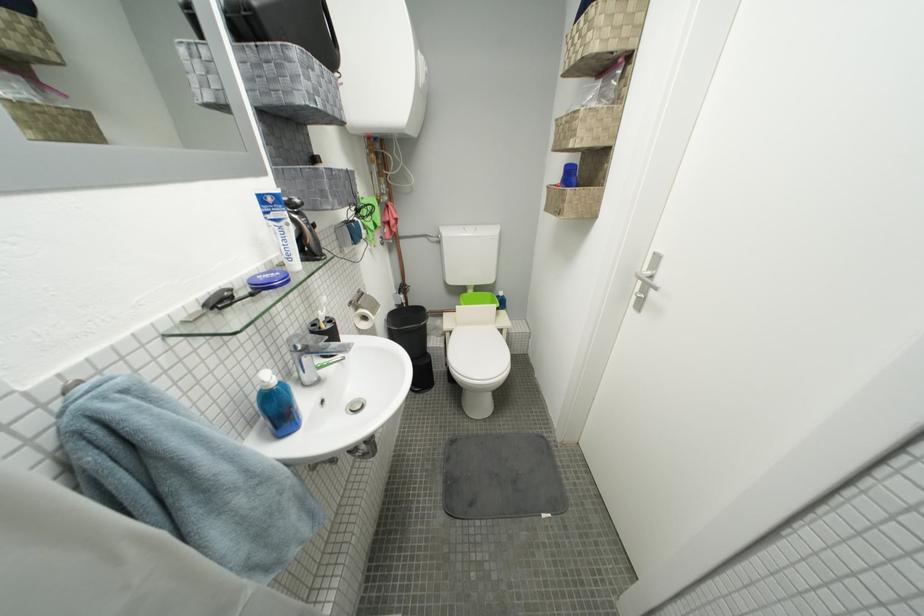
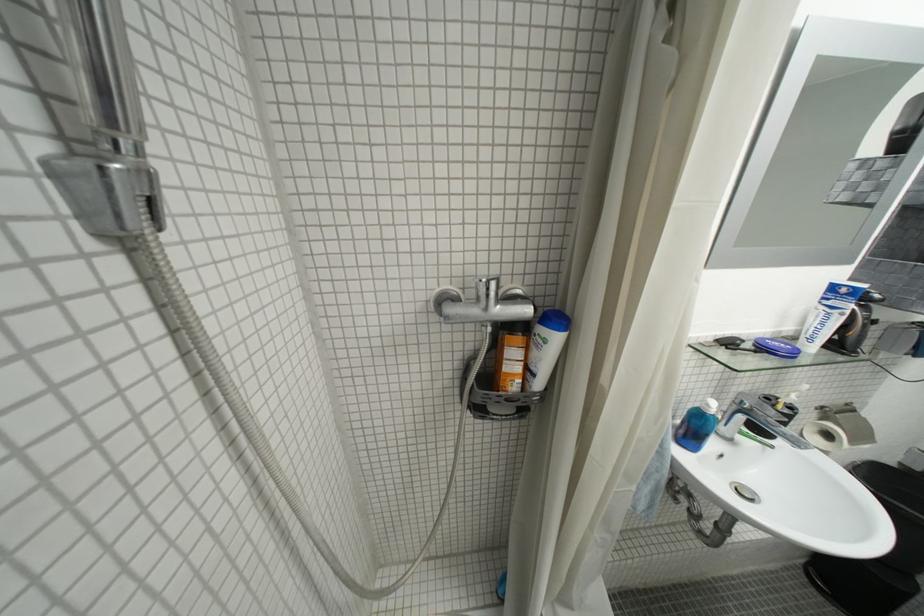
Find the pixel in the second image that matches [239,293] in the first image.

(751, 342)